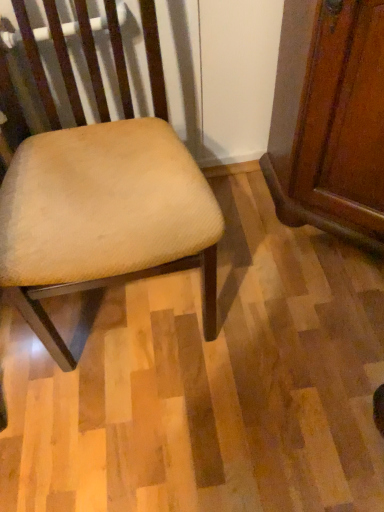
Describe the element at coordinates (104, 194) in the screenshot. The height and width of the screenshot is (512, 384). I see `beige fabric chair at center` at that location.

At what (x,y) coordinates should I click in order to perform the action: click on beige fabric chair at center. Please return your answer as a coordinate pair (x, y). Looking at the image, I should click on (104, 194).

What is the approximate width of beige fabric chair at center?

beige fabric chair at center is 22.02 inches in width.

Locate an element on the screen. beige fabric chair at center is located at coordinates (104, 194).